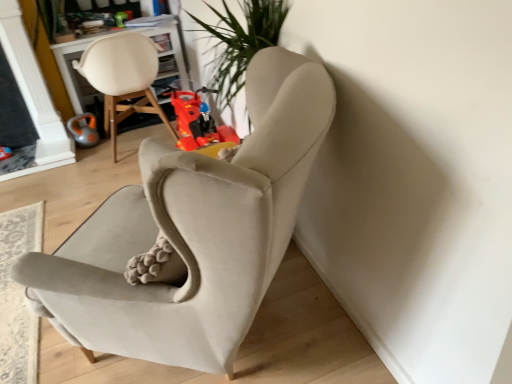
This screenshot has width=512, height=384. Find the location of `free area in between orange rubber toy at left, marked as the first toy in a left-to-right arrangement, and matte white chair at upper left, which appears as the second chair when viewed from the right`. free area in between orange rubber toy at left, marked as the first toy in a left-to-right arrangement, and matte white chair at upper left, which appears as the second chair when viewed from the right is located at coordinates (102, 153).